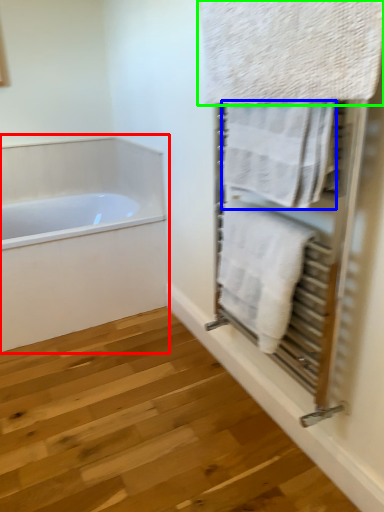
Question: Considering the real-world distances, which object is farthest from bathtub (highlighted by a red box)? towel (highlighted by a blue box) or towel (highlighted by a green box)?

Choices:
 (A) towel
 (B) towel

Answer: (B)